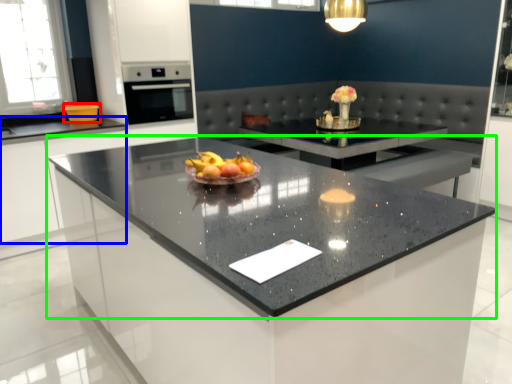
Question: Estimate the real-world distances between objects in this image. Which object is closer to kitchen appliance (highlighted by a red box), cabinetry (highlighted by a blue box) or countertop (highlighted by a green box)?

Choices:
 (A) cabinetry
 (B) countertop

Answer: (A)